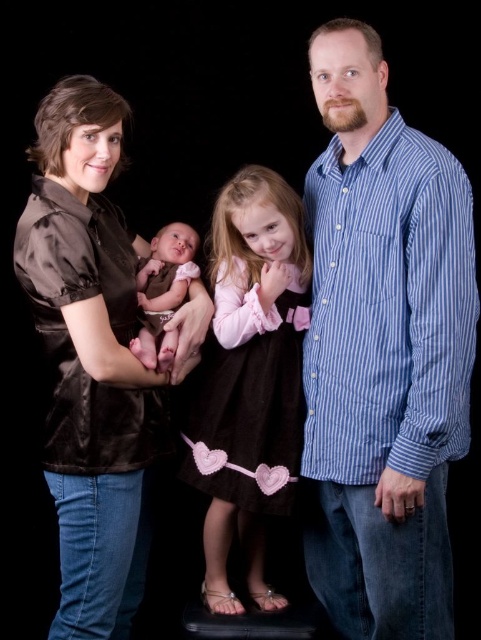
Is matte brown dress at center wider than smooth pink fabric at center?

Correct, the width of matte brown dress at center exceeds that of smooth pink fabric at center.

At what (x,y) coordinates should I click in order to perform the action: click on matte brown dress at center. Please return your answer as a coordinate pair (x, y). This screenshot has width=481, height=640. Looking at the image, I should click on (250, 378).

Who is more forward, (442, 320) or (101, 502)?

Positioned in front is point (442, 320).

Can you confirm if blue striped shirt at center is positioned above satin brown blouse at left?

Indeed, blue striped shirt at center is positioned over satin brown blouse at left.

Who is more forward, (304, 506) or (45, 342)?

Point (45, 342) is in front.

Where is `blue striped shirt at center`? blue striped shirt at center is located at coordinates 382,349.

In the scene shown: Who is lower down, blue striped shirt at center or matte brown dress at center?

matte brown dress at center

Is blue striped shirt at center thinner than matte brown dress at center?

In fact, blue striped shirt at center might be wider than matte brown dress at center.

Does point (427, 189) come farther from viewer compared to point (256, 180)?

No, it is in front of (256, 180).

I want to click on blue striped shirt at center, so click(x=382, y=349).